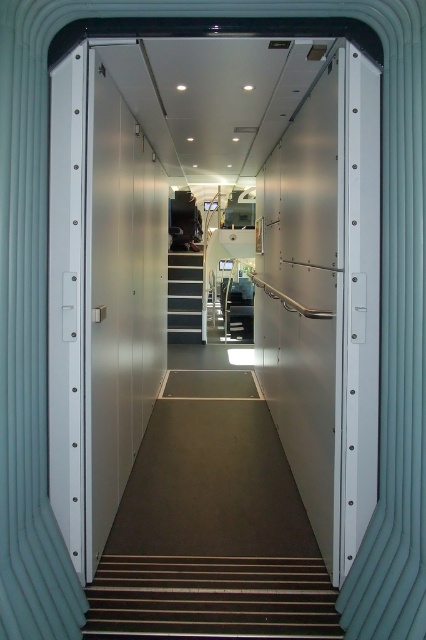
You are a delivery person carrying a heavy box and need to descend the wooden stairs at lower center and the white glossy stair at center. Which staircase has fewer steps and would be quicker to descend?

The wooden stairs at lower center has a lesser height compared to the white glossy stair at center, so it likely has fewer steps and would be quicker to descend.